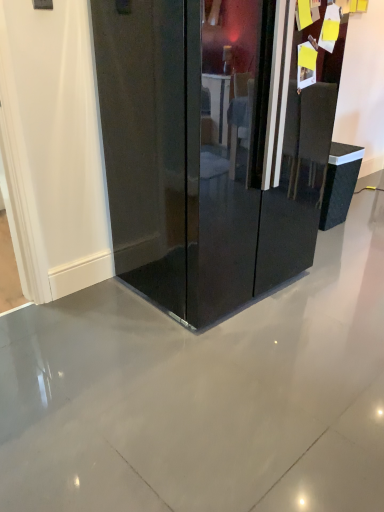
Find the location of `glossy black refrigerator at center`. glossy black refrigerator at center is located at coordinates (209, 150).

Measure the distance between point (x=164, y=206) and camera.

Point (x=164, y=206) and camera are 1.86 meters apart from each other.

The width and height of the screenshot is (384, 512). What do you see at coordinates (209, 150) in the screenshot? I see `glossy black refrigerator at center` at bounding box center [209, 150].

You are a GUI agent. You are given a task and a screenshot of the screen. Output one action in this format:
    pyautogui.click(x=<x>, y=<y>)
    Task: Click on the black glossy trash can at right
    This screenshot has height=512, width=384.
    Given the screenshot: What is the action you would take?
    point(339,183)

This screenshot has height=512, width=384. What do you see at coordinates (339, 183) in the screenshot?
I see `black glossy trash can at right` at bounding box center [339, 183].

You are a GUI agent. You are given a task and a screenshot of the screen. Output one action in this format:
    pyautogui.click(x=<x>, y=<y>)
    Task: Click on the glossy black refrigerator at center
    
    Given the screenshot: What is the action you would take?
    pyautogui.click(x=209, y=150)

Is glossy black refrigerator at center at the right side of black glossy trash can at right?

Incorrect, glossy black refrigerator at center is not on the right side of black glossy trash can at right.

Considering the positions of objects glossy black refrigerator at center and black glossy trash can at right in the image provided, who is behind, glossy black refrigerator at center or black glossy trash can at right?

black glossy trash can at right.

Does point (132, 75) come farther from viewer compared to point (322, 211)?

No.

From the image's perspective, which object appears higher, glossy black refrigerator at center or black glossy trash can at right?

glossy black refrigerator at center, from the image's perspective.

From a real-world perspective, who is located lower, glossy black refrigerator at center or black glossy trash can at right?

black glossy trash can at right is physically lower.

Which object is wider, glossy black refrigerator at center or black glossy trash can at right?

glossy black refrigerator at center is wider.

Can you confirm if glossy black refrigerator at center is shorter than black glossy trash can at right?

No, glossy black refrigerator at center is not shorter than black glossy trash can at right.

Who is smaller, glossy black refrigerator at center or black glossy trash can at right?

black glossy trash can at right is smaller.

Is glossy black refrigerator at center completely or partially outside of black glossy trash can at right?

Indeed, glossy black refrigerator at center is completely outside black glossy trash can at right.

Is glossy black refrigerator at center touching black glossy trash can at right?

They are not placed beside each other.

Is glossy black refrigerator at center facing towards black glossy trash can at right?

No, glossy black refrigerator at center is not facing towards black glossy trash can at right.

Where is `furniture to the right of glossy black refrigerator at center`? furniture to the right of glossy black refrigerator at center is located at coordinates (339, 183).

Which object is positioned more to the left, black glossy trash can at right or glossy black refrigerator at center?

Positioned to the left is glossy black refrigerator at center.

Is black glossy trash can at right behind glossy black refrigerator at center?

Yes, black glossy trash can at right is further from the viewer.

Does point (323, 217) appear closer or farther from the camera than point (103, 12)?

Clearly, point (323, 217) is more distant from the camera than point (103, 12).

From the image's perspective, between black glossy trash can at right and glossy black refrigerator at center, which one is located above?

From the image's view, glossy black refrigerator at center is above.

From a real-world perspective, is black glossy trash can at right beneath glossy black refrigerator at center?

Yes.

Which of these two, black glossy trash can at right or glossy black refrigerator at center, is thinner?

black glossy trash can at right.

Is black glossy trash can at right taller or shorter than glossy black refrigerator at center?

Considering their sizes, black glossy trash can at right has less height than glossy black refrigerator at center.

Based on their sizes in the image, would you say black glossy trash can at right is bigger or smaller than glossy black refrigerator at center?

Clearly, black glossy trash can at right is smaller in size than glossy black refrigerator at center.

Is black glossy trash can at right positioned beyond the bounds of glossy black refrigerator at center?

That's correct, black glossy trash can at right is outside of glossy black refrigerator at center.

Is black glossy trash can at right positioned far away from glossy black refrigerator at center?

Yes, black glossy trash can at right and glossy black refrigerator at center are quite far apart.

Could you tell me if black glossy trash can at right is turned towards glossy black refrigerator at center?

No, black glossy trash can at right is not facing towards glossy black refrigerator at center.

This screenshot has height=512, width=384. Identify the location of glass door positioned vertically above the black glossy trash can at right (from a real-world perspective). (209, 150).

Identify the location of furniture that is below the glossy black refrigerator at center (from the image's perspective). This screenshot has width=384, height=512. (339, 183).

The height and width of the screenshot is (512, 384). Find the location of `furniture below the glossy black refrigerator at center (from a real-world perspective)`. furniture below the glossy black refrigerator at center (from a real-world perspective) is located at coordinates (339, 183).